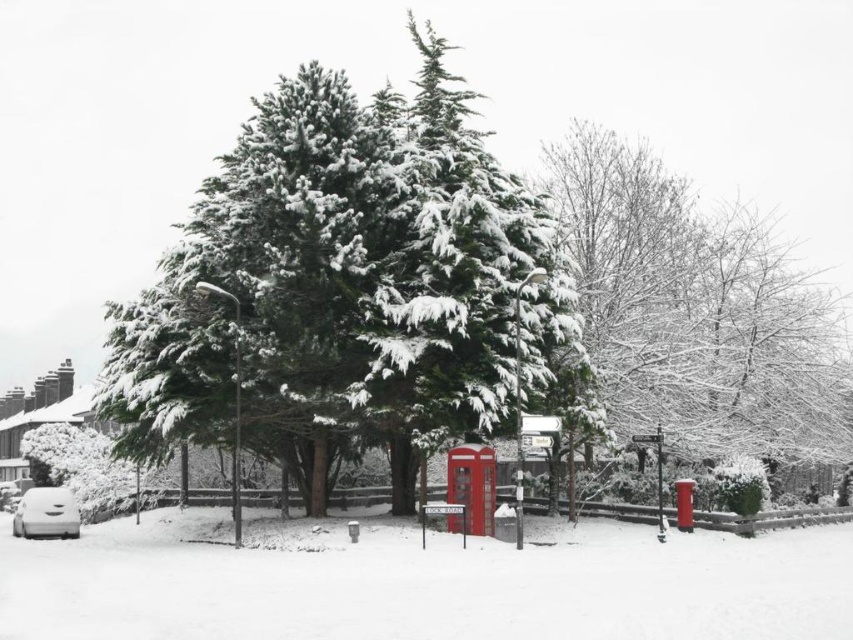
Question: Which of the following is the farthest from the observer?

Choices:
 (A) white matte car at lower left
 (B) snow-covered evergreen tree at center
 (C) metallic red phone box at center
 (D) white fluffy snow at lower center

Answer: (A)

Question: Can you confirm if snow-covered evergreen tree at center is positioned to the right of white matte car at lower left?

Choices:
 (A) no
 (B) yes

Answer: (B)

Question: Can you confirm if white fluffy snow at lower center is bigger than white matte car at lower left?

Choices:
 (A) no
 (B) yes

Answer: (B)

Question: Does snow-covered evergreen tree at center lie behind white matte car at lower left?

Choices:
 (A) yes
 (B) no

Answer: (B)

Question: Which object is positioned farthest from the snow-covered evergreen tree at center?

Choices:
 (A) white fluffy snow at lower center
 (B) white matte car at lower left

Answer: (B)

Question: Which object appears farthest from the camera in this image?

Choices:
 (A) green textured tree at center
 (B) white matte car at lower left
 (C) white fluffy snow at lower center
 (D) snow-covered evergreen tree at center

Answer: (B)